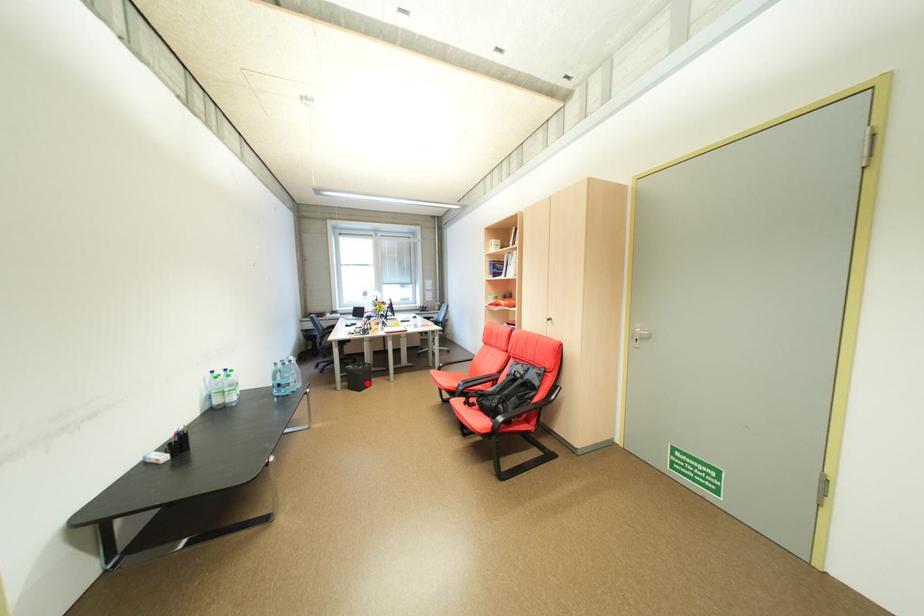
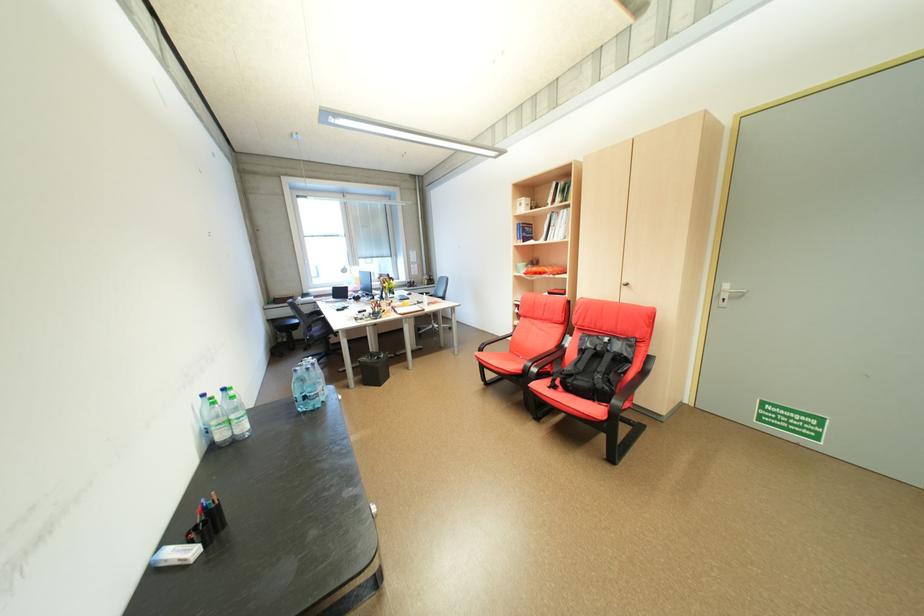
Question: I am providing you with two images of the same scene from different viewpoints. Given a red point in image1, look at the same physical point in image2. Is it:

Choices:
 (A) Closer to the viewpoint
 (B) Farther from the viewpoint

Answer: (B)